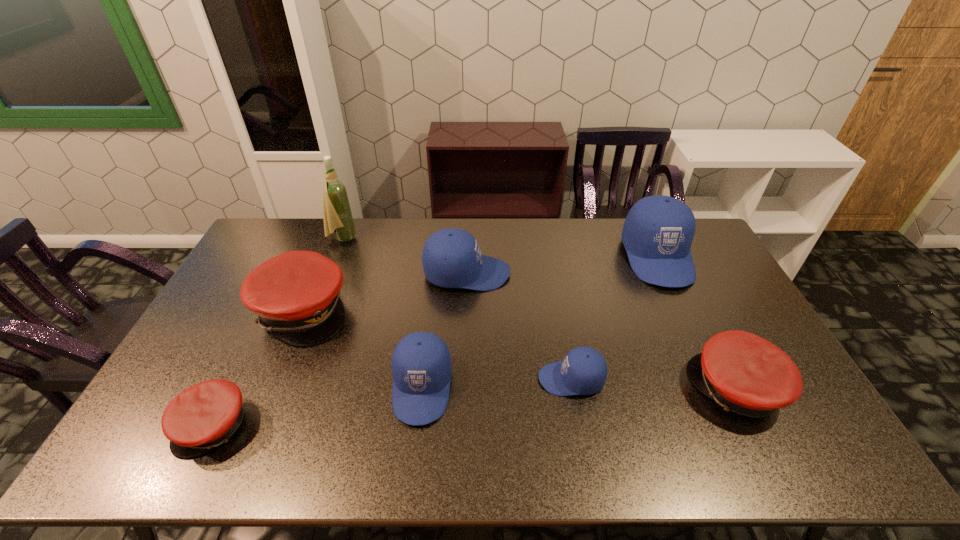
Identify the location of free space at the far left corner of the desktop. Image resolution: width=960 pixels, height=540 pixels. (280, 246).

The height and width of the screenshot is (540, 960). What are the coordinates of `free space between the tallest object and the rightmost blue cap` in the screenshot? It's located at (500, 248).

You are a GUI agent. You are given a task and a screenshot of the screen. Output one action in this format:
    pyautogui.click(x=<x>, y=<y>)
    Task: Click on the vacant region between the wine bottle and the third tallest object
    
    Given the screenshot: What is the action you would take?
    pyautogui.click(x=405, y=256)

This screenshot has width=960, height=540. Find the location of `blank region between the rightmost red cap and the smallest blue cap`. blank region between the rightmost red cap and the smallest blue cap is located at coordinates (654, 384).

Locate an element on the screen. This screenshot has height=540, width=960. empty space that is in between the second biggest blue cap and the tallest object is located at coordinates (405, 256).

At what (x,y) coordinates should I click in order to perform the action: click on free space between the biggest red cap and the smallest red cap. Please return your answer as a coordinate pair (x, y). This screenshot has width=960, height=540. Looking at the image, I should click on (258, 368).

This screenshot has width=960, height=540. In order to click on free space between the farthest red cap and the smallest red cap in this screenshot , I will do `click(258, 368)`.

Choose which object is the fourth nearest neighbor to the second smallest blue cap. Please provide its 2D coordinates. Your answer should be formatted as a tuple, i.e. [(x, y)], where the tuple contains the x and y coordinates of a point satisfying the conditions above.

[(205, 415)]

The image size is (960, 540). What are the coordinates of `object that stands as the fifth closest to the rightmost blue cap` in the screenshot? It's located at (296, 294).

I want to click on cap that is the third closest to the biggest red cap, so click(x=451, y=258).